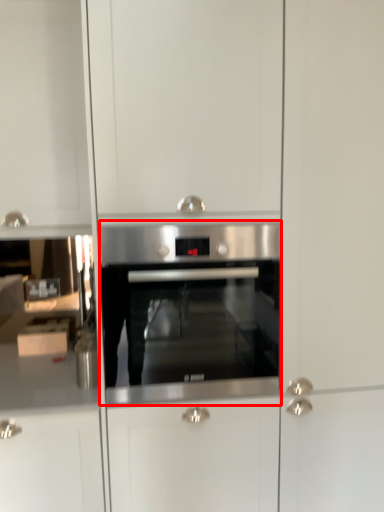
Question: Observing the image, what is the correct spatial positioning of oven (annotated by the red box) in reference to cabinetry?

Choices:
 (A) right
 (B) left

Answer: (A)